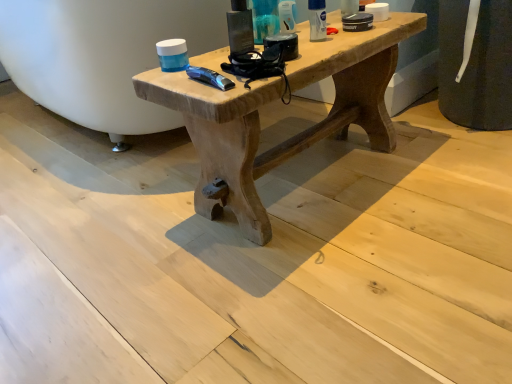
What are the coordinates of `free space on the front side of matte plastic container at upper center, the 1th toiletry viewed from the left` in the screenshot? It's located at (286, 58).